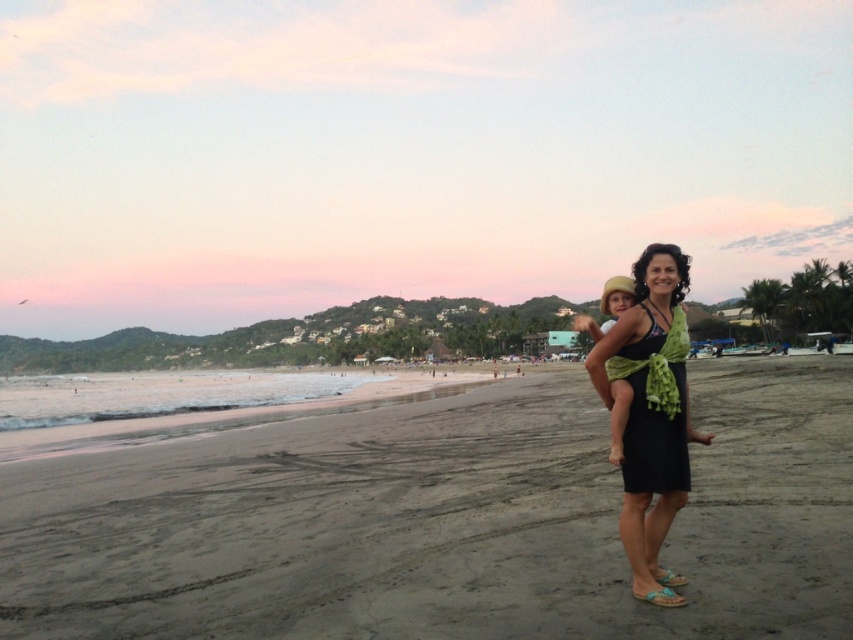
Can you confirm if dark brown sand at center is thinner than black satin dress at center?

In fact, dark brown sand at center might be wider than black satin dress at center.

Which is above, dark brown sand at center or black satin dress at center?

black satin dress at center is above.

Who is more distant from viewer, (427, 516) or (664, 355)?

Point (427, 516)

Identify the location of dark brown sand at center. The width and height of the screenshot is (853, 640). coord(444,522).

Does dark brown sand at center have a greater width compared to black fabric dress at center?

Indeed, dark brown sand at center has a greater width compared to black fabric dress at center.

Is point (741, 577) farther from camera compared to point (611, 401)?

Yes, it is behind point (611, 401).

Locate an element on the screen. dark brown sand at center is located at coordinates (444, 522).

The width and height of the screenshot is (853, 640). What are the coordinates of `dark brown sand at center` in the screenshot? It's located at (444, 522).

Between black fabric dress at center and black satin dress at center, which one is positioned lower?

black fabric dress at center is lower down.

Is black fabric dress at center positioned before black satin dress at center?

No, it is behind black satin dress at center.

Is point (624, 452) farther from camera compared to point (651, 330)?

Yes, point (624, 452) is behind point (651, 330).

Identify the location of black fabric dress at center. This screenshot has height=640, width=853. (651, 413).